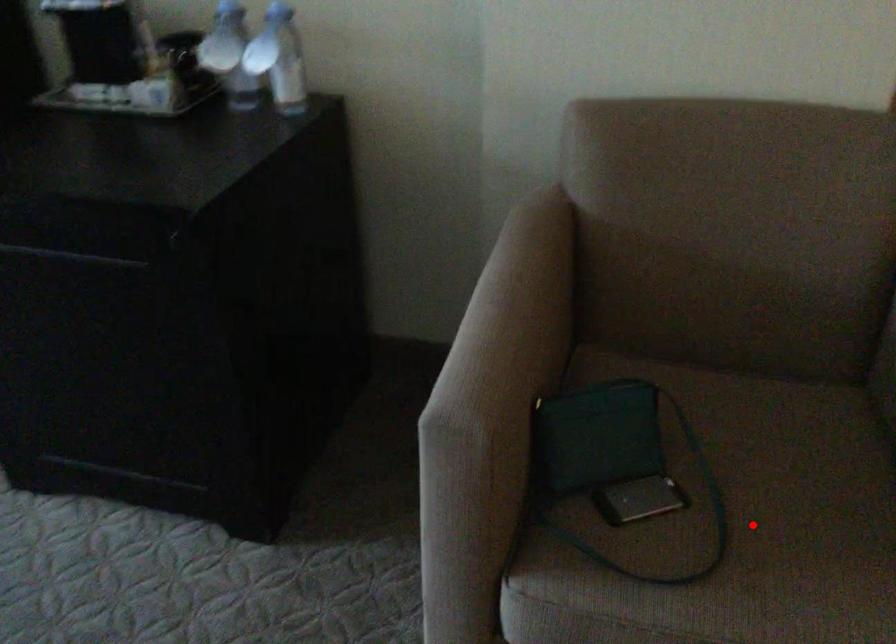
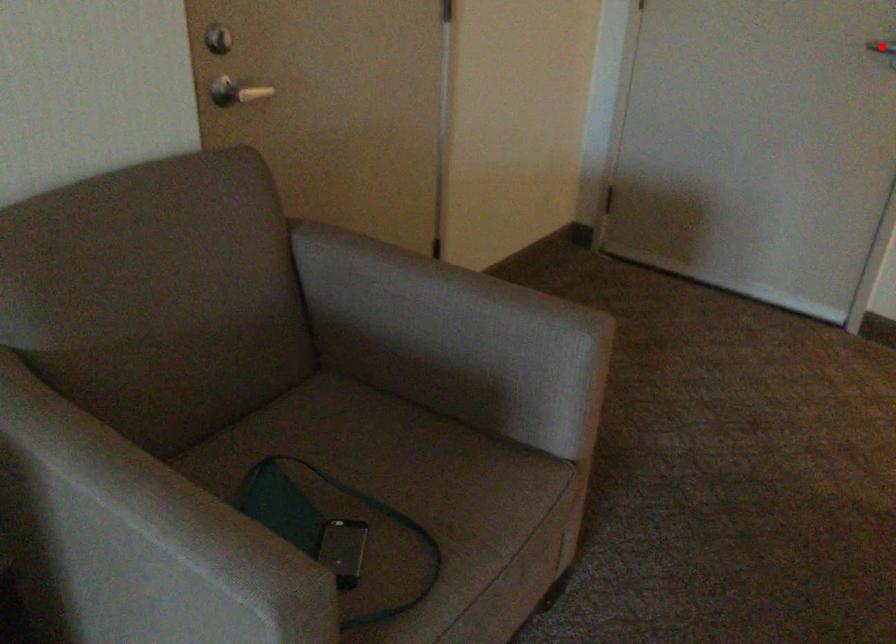
I am providing you with two images of the same scene from different viewpoints. A red point is marked on the first image and another point is marked on the second image. Is the marked point in image1 the same physical position as the marked point in image2?

No